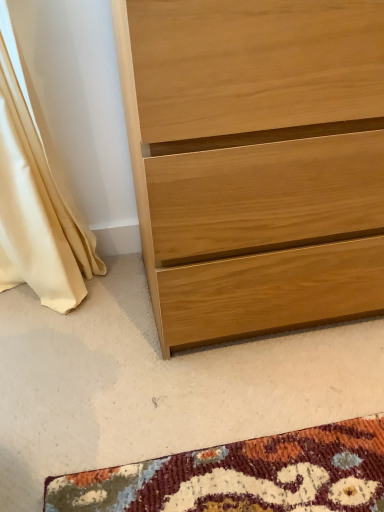
Find the location of a particular element. The width and height of the screenshot is (384, 512). free space in front of light brown wood chest of drawers at lower right is located at coordinates (263, 416).